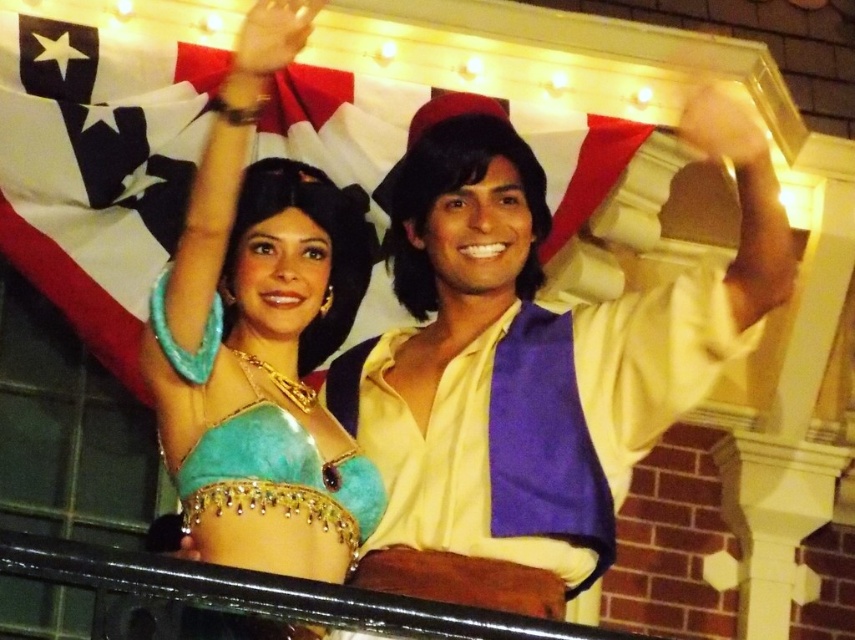
You are a GUI agent. You are given a task and a screenshot of the screen. Output one action in this format:
    pyautogui.click(x=<x>, y=<y>)
    Task: Click on the yellow satin shirt at center
    
    Given the screenshot: What is the action you would take?
    pyautogui.click(x=540, y=353)

Who is positioned more to the right, yellow satin shirt at center or turquoise felt belly dancer costume at upper left?

From the viewer's perspective, yellow satin shirt at center appears more on the right side.

Is point (709, 300) positioned before point (187, 307)?

That is False.

You are a GUI agent. You are given a task and a screenshot of the screen. Output one action in this format:
    pyautogui.click(x=<x>, y=<y>)
    Task: Click on the yellow satin shirt at center
    The height and width of the screenshot is (640, 855).
    Given the screenshot: What is the action you would take?
    pyautogui.click(x=540, y=353)

Is white fabric flag at upper center smaller than turquoise felt belly dancer costume at upper left?

No, white fabric flag at upper center is not smaller than turquoise felt belly dancer costume at upper left.

Who is more forward, (63, 128) or (343, 218)?

Point (343, 218) is in front.

Identify the location of white fabric flag at upper center. Image resolution: width=855 pixels, height=640 pixels. (97, 168).

Can you confirm if yellow satin shirt at center is bigger than white fabric flag at upper center?

Indeed, yellow satin shirt at center has a larger size compared to white fabric flag at upper center.

Does yellow satin shirt at center have a smaller size compared to white fabric flag at upper center?

Incorrect, yellow satin shirt at center is not smaller in size than white fabric flag at upper center.

Identify the location of yellow satin shirt at center. click(x=540, y=353).

You are a GUI agent. You are given a task and a screenshot of the screen. Output one action in this format:
    pyautogui.click(x=<x>, y=<y>)
    Task: Click on the yellow satin shirt at center
    
    Given the screenshot: What is the action you would take?
    pyautogui.click(x=540, y=353)